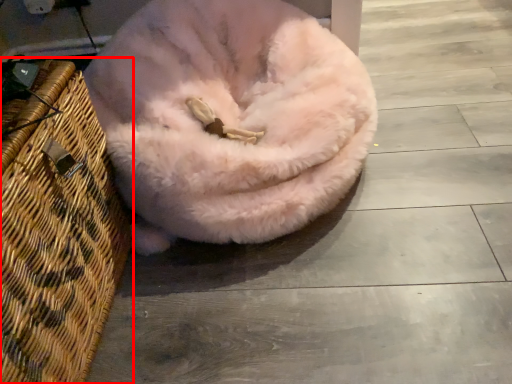
Question: From the image's perspective, what is the correct spatial positioning of basket (annotated by the red box) in reference to dog bed?

Choices:
 (A) below
 (B) above

Answer: (A)